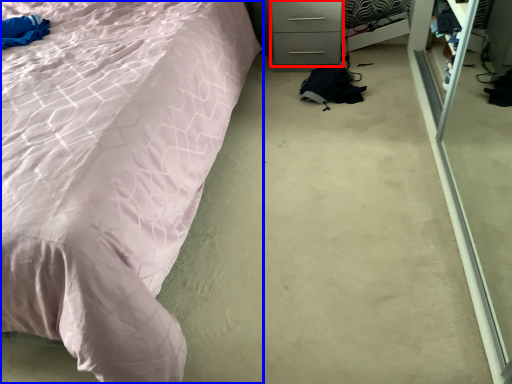
Question: Which of the following is the farthest to the observer, drawer (highlighted by a red box) or bed (highlighted by a blue box)?

Choices:
 (A) drawer
 (B) bed

Answer: (A)